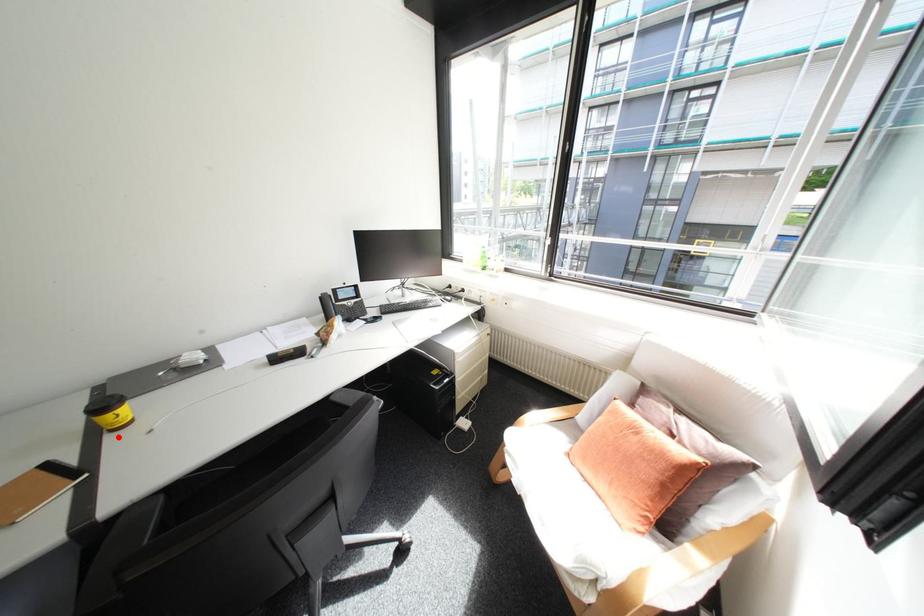
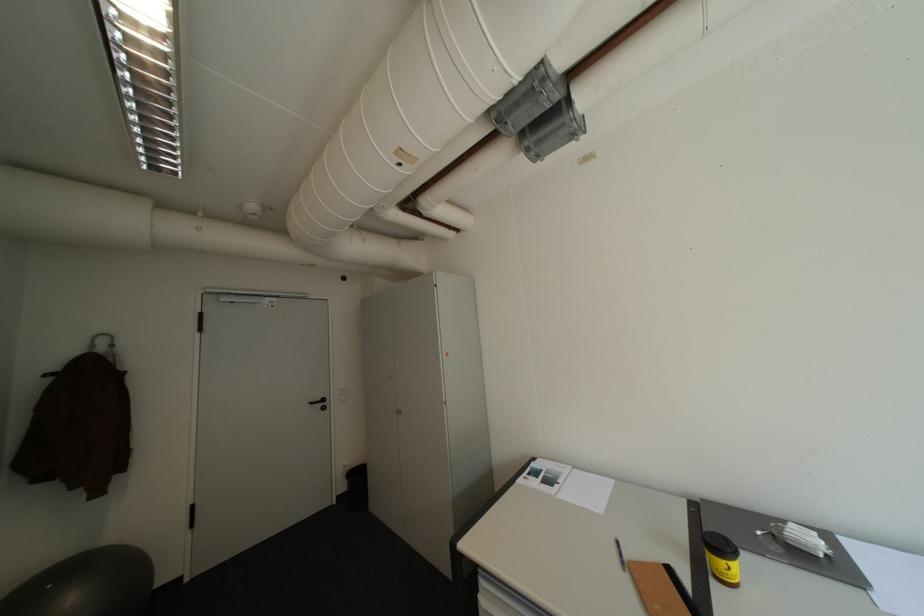
Locate, in the second image, the point that corresponds to the highlighted location in the first image.

(723, 584)